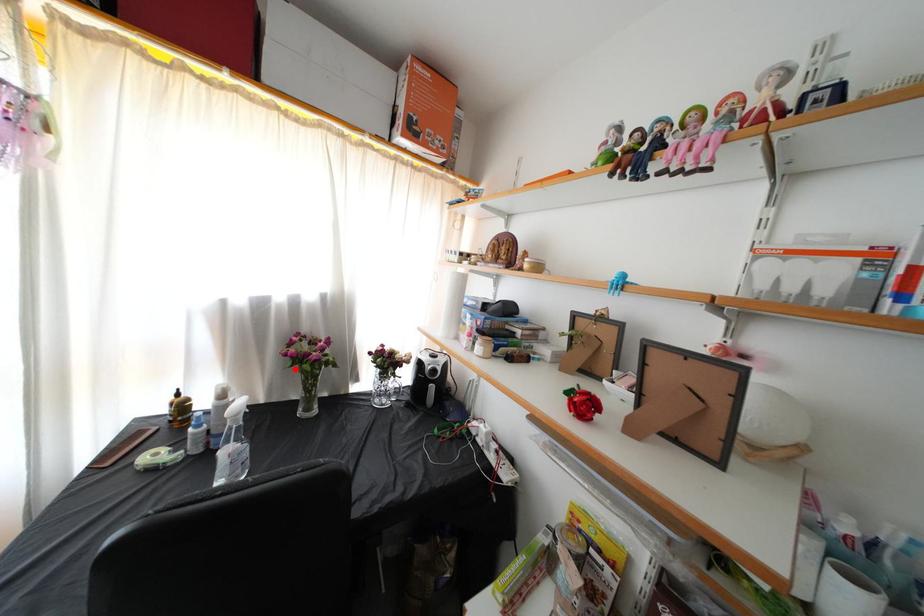
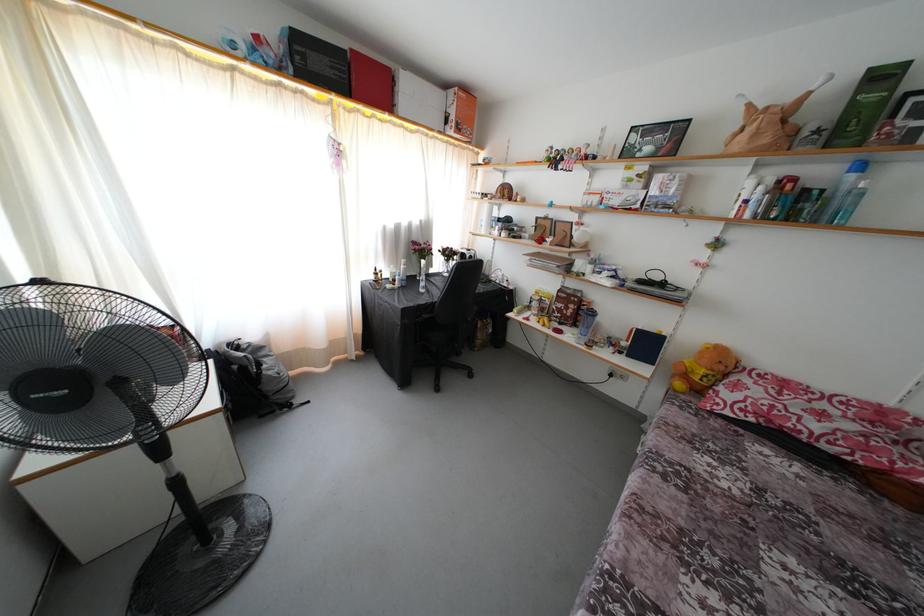
Question: I am providing you with two images of the same scene from different viewpoints. Given a red point in image1, look at the same physical point in image2. Is it:

Choices:
 (A) Closer to the viewpoint
 (B) Farther from the viewpoint

Answer: (A)